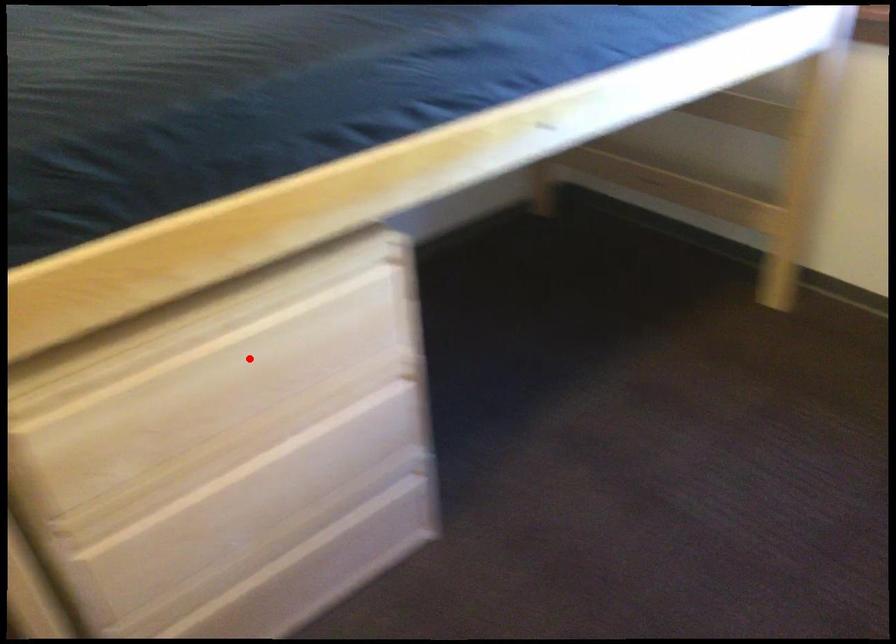
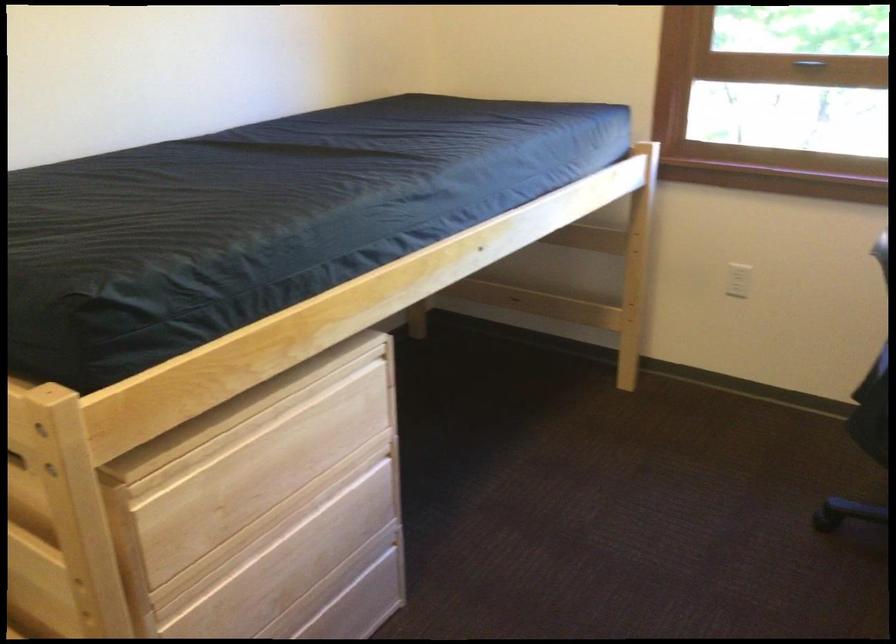
Question: I am providing you with two images of the same scene from different viewpoints. In image1, a red point is highlighted. Considering the same 3D point in image2, which of the following is correct?

Choices:
 (A) It is closer
 (B) It is farther

Answer: (B)